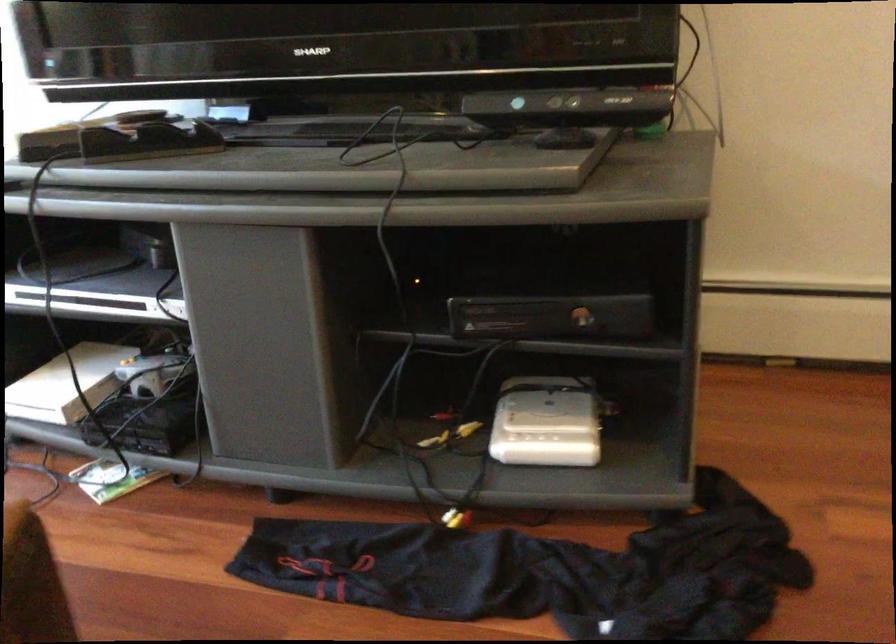
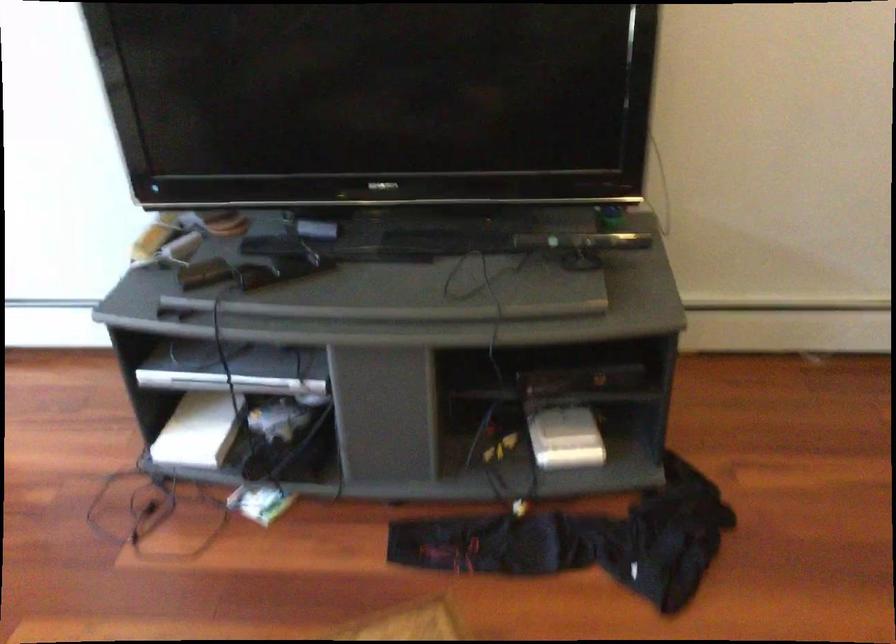
Question: I am providing you with two images of the same scene from different viewpoints. Please identify which objects are invisible in image2.

Choices:
 (A) white game console
 (B) small game case
 (C) black sensor bar
 (D) none of these

Answer: (D)